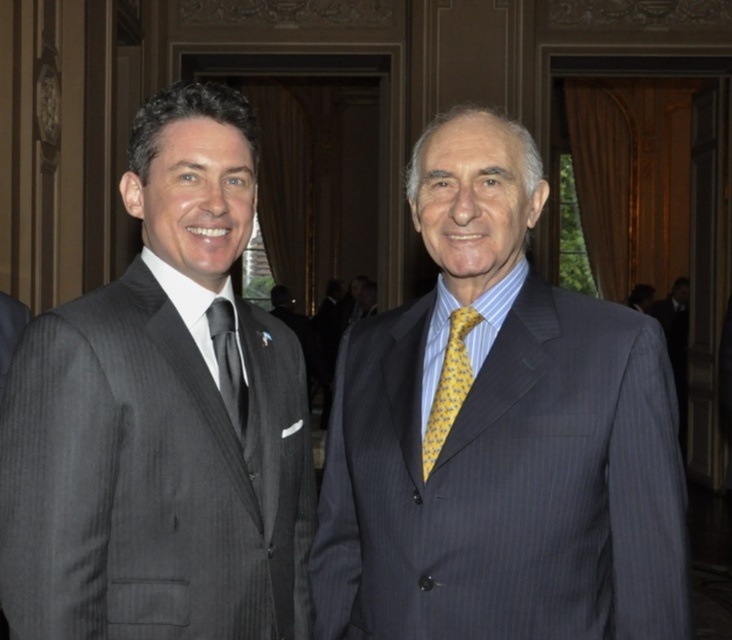
Which is more to the right, matte gray suit at center or gray pinstripe suit at left?

From the viewer's perspective, matte gray suit at center appears more on the right side.

Who is more forward, (x=447, y=243) or (x=0, y=614)?

Point (x=447, y=243)

Is point (526, 608) in front of point (4, 618)?

That is True.

I want to click on matte gray suit at center, so click(498, 438).

Who is taller, yellow printed silk tie at center or gray pinstripe suit at left?

gray pinstripe suit at left

Does yellow printed silk tie at center have a lesser width compared to gray pinstripe suit at left?

Yes, yellow printed silk tie at center is thinner than gray pinstripe suit at left.

Is point (470, 368) positioned after point (14, 326)?

No, (470, 368) is in front of (14, 326).

Locate an element on the screen. yellow printed silk tie at center is located at coordinates (449, 385).

Is matte gray tie at left closer to the viewer compared to gray pinstripe suit at left?

Yes, matte gray tie at left is in front of gray pinstripe suit at left.

What do you see at coordinates (228, 365) in the screenshot? Image resolution: width=732 pixels, height=640 pixels. I see `matte gray tie at left` at bounding box center [228, 365].

Find the location of a particular element. The image size is (732, 640). matte gray tie at left is located at coordinates pyautogui.click(x=228, y=365).